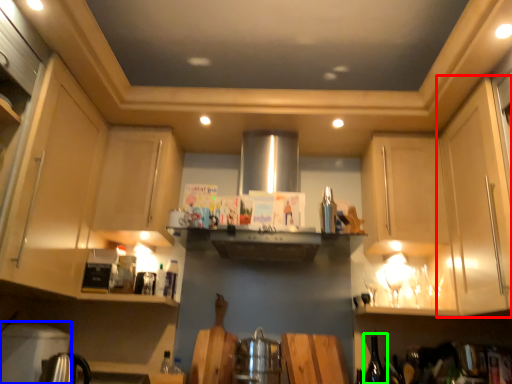
Question: Based on their relative distances, which object is farther from cabinetry (highlighted by a red box)? Choose from appliance (highlighted by a blue box) and wine bottle (highlighted by a green box).

Choices:
 (A) appliance
 (B) wine bottle

Answer: (A)